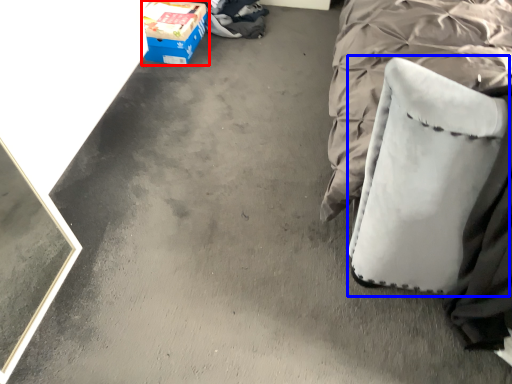
Question: Which object appears closest to the camera in this image, box (highlighted by a red box) or swivel chair (highlighted by a blue box)?

Choices:
 (A) box
 (B) swivel chair

Answer: (B)